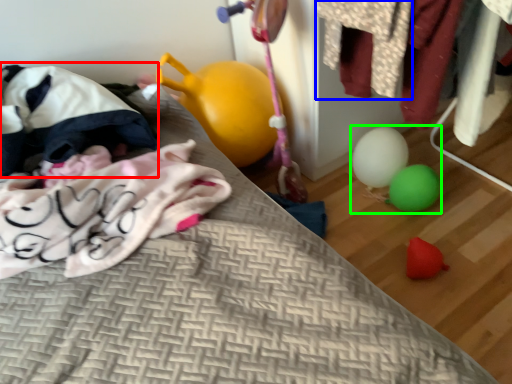
Question: Based on their relative distances, which object is nearer to bean bag chair (highlighted by a red box)? Choose from clothing (highlighted by a blue box) and toy (highlighted by a green box).

Choices:
 (A) clothing
 (B) toy

Answer: (A)